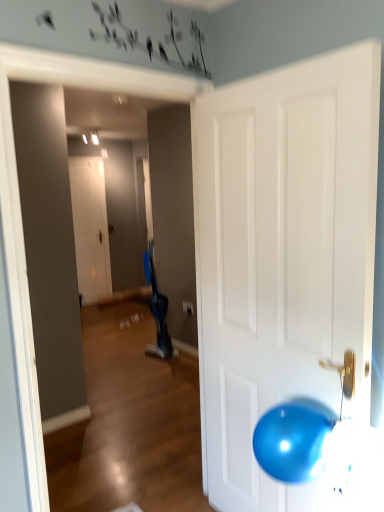
Question: From the image's perspective, is white matte door at center, arranged as the second door when viewed from the right, on glossy white door at right, positioned as the 2th door in back-to-front order?

Choices:
 (A) yes
 (B) no

Answer: (A)

Question: Considering the relative sizes of white matte door at center, placed as the 1th door when sorted from left to right, and glossy white door at right, positioned as the 2th door in back-to-front order, in the image provided, is white matte door at center, placed as the 1th door when sorted from left to right, thinner than glossy white door at right, positioned as the 2th door in back-to-front order,?

Choices:
 (A) yes
 (B) no

Answer: (A)

Question: Can you confirm if white matte door at center, arranged as the second door when viewed from the right, is positioned to the left of glossy white door at right, which ranks as the first door in right-to-left order?

Choices:
 (A) no
 (B) yes

Answer: (B)

Question: Is white matte door at center, arranged as the second door when viewed from the right, positioned behind glossy white door at right, positioned as the 2th door in back-to-front order?

Choices:
 (A) yes
 (B) no

Answer: (A)

Question: From the image's perspective, is white matte door at center, which is the second door in front-to-back order, located beneath glossy white door at right, the second door from the left?

Choices:
 (A) yes
 (B) no

Answer: (B)

Question: Are white matte door at center, which is the second door in front-to-back order, and glossy white door at right, the second door from the left, far apart?

Choices:
 (A) yes
 (B) no

Answer: (A)

Question: Is glossy white door at right, which ranks as the first door in right-to-left order, positioned beyond the bounds of white matte door at center, which is the second door in front-to-back order?

Choices:
 (A) yes
 (B) no

Answer: (A)

Question: Considering the relative sizes of glossy white door at right, the second door from the left, and white matte door at center, which is the second door in front-to-back order, in the image provided, is glossy white door at right, the second door from the left, thinner than white matte door at center, which is the second door in front-to-back order,?

Choices:
 (A) no
 (B) yes

Answer: (A)

Question: Is glossy white door at right, which ranks as the first door in right-to-left order, turned away from white matte door at center, placed as the 1th door when sorted from left to right?

Choices:
 (A) no
 (B) yes

Answer: (A)

Question: Is white matte door at center, the first door positioned from the back, inside glossy white door at right, the 1th door positioned from the front?

Choices:
 (A) yes
 (B) no

Answer: (B)

Question: Does glossy white door at right, the 1th door positioned from the front, appear on the right side of white matte door at center, placed as the 1th door when sorted from left to right?

Choices:
 (A) no
 (B) yes

Answer: (B)

Question: Can you confirm if glossy white door at right, positioned as the 2th door in back-to-front order, is smaller than white matte door at center, arranged as the second door when viewed from the right?

Choices:
 (A) yes
 (B) no

Answer: (B)

Question: Is white matte door at center, arranged as the second door when viewed from the right, wider or thinner than glossy white door at right, the 1th door positioned from the front?

Choices:
 (A) wide
 (B) thin

Answer: (B)